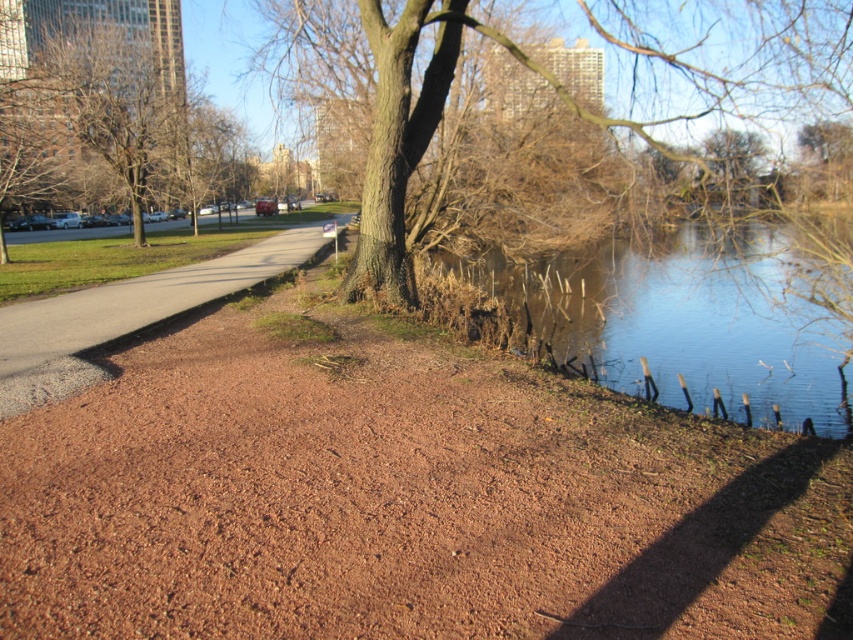
Consider the image. You are a delivery person trying to navigate through the park. You need to determine which object, the brown dirt path at center or the brown rough bark tree at center, is shorter in height to ensure your delivery cart can pass underneath it without hitting anything. Which one is shorter?

The brown dirt path at center is not as tall as the brown rough bark tree at center, so the brown dirt path at center is shorter in height. Therefore, the delivery cart can pass underneath the brown dirt path at center without hitting anything.

You are standing at the edge of the brown dirt path at center in the park. You want to walk straight ahead towards the road where parked cars are located. How far will you have to walk to reach the road?

The brown dirt path at center is 3.15 meters away from the camera, so you would need to walk approximately 3.15 meters forward to reach the road where the parked cars are located.

You are standing at the point closer to the viewer in the image. There are two points marked in the scene, one at coordinates point (675,582) and another at point (86,112). Which direction should you walk to reach the farther point?

You should walk towards the background of the image to reach the farther point (86,112) since it is located further away from the viewer compared to point (675,582).